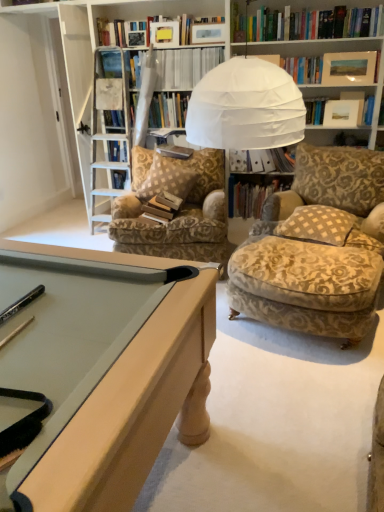
You are a GUI agent. You are given a task and a screenshot of the screen. Output one action in this format:
    pyautogui.click(x=<x>, y=<y>)
    Task: Click on the vacant point above velvet beige ottoman at lower right, acting as the second chair starting from the back (from a real-world perspective)
    Image resolution: width=384 pixels, height=512 pixels.
    Given the screenshot: What is the action you would take?
    pyautogui.click(x=326, y=247)